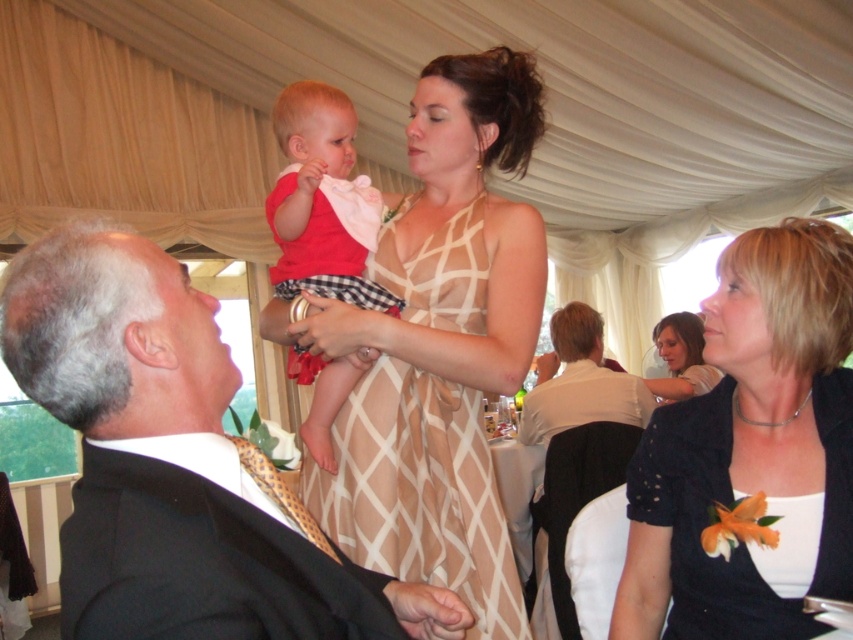
You are a photographer at a social event and need to capture a photo of both the matte black dress at lower right and the matte white dress at upper right in the same frame. Given that your camera has a focal length of 50mm and a sensor size that allows for a maximum distance between subjects of 8 feet, will you be able to include both dresses in the photo without moving closer or further away?

The matte black dress at lower right is 7.04 feet from the matte white dress at upper right. Since the maximum distance your camera can handle is 8 feet, you can include both dresses in the photo as 7.04 feet is within the 8 feet limit.

You are standing at the point labeled point (167, 548) and want to move to the point labeled point (695, 340). Given that you can only move forward in a straight line, will you pass through any obstacles along the way?

Since point (167, 548) is in front of point (695, 340), moving forward in a straight line from point (167, 548) towards point (695, 340) would require moving backward, which contradicts the movement constraint. Therefore, you cannot reach point (695, 340) without changing direction or moving backward.